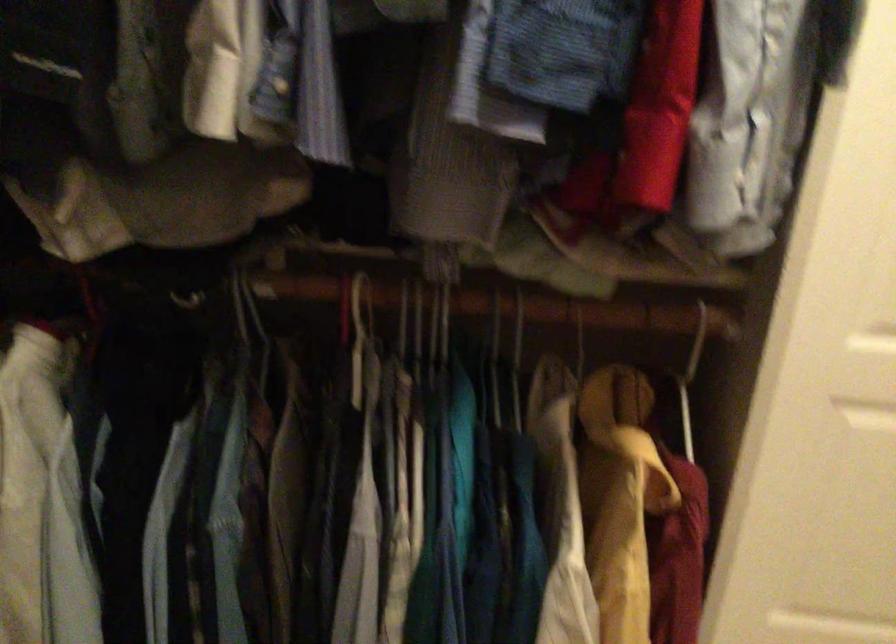
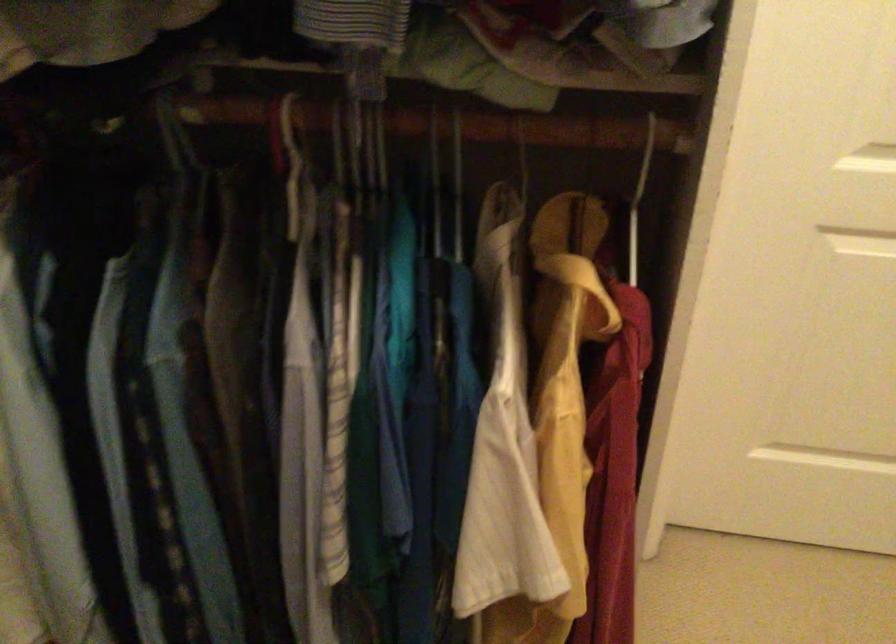
Question: The images are taken continuously from a first-person perspective. In which direction is your viewpoint rotating?

Choices:
 (A) Left
 (B) Right
 (C) Up
 (D) Down

Answer: (D)